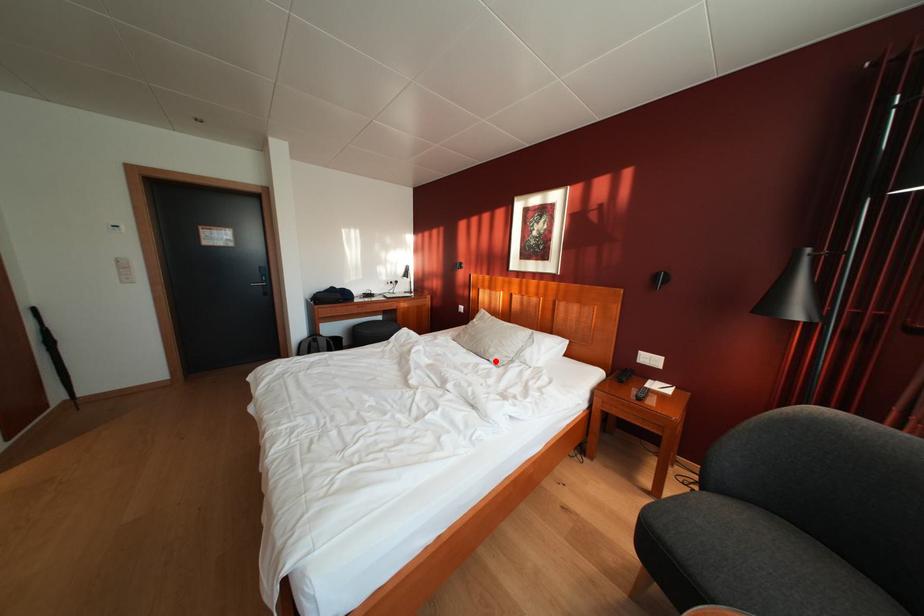
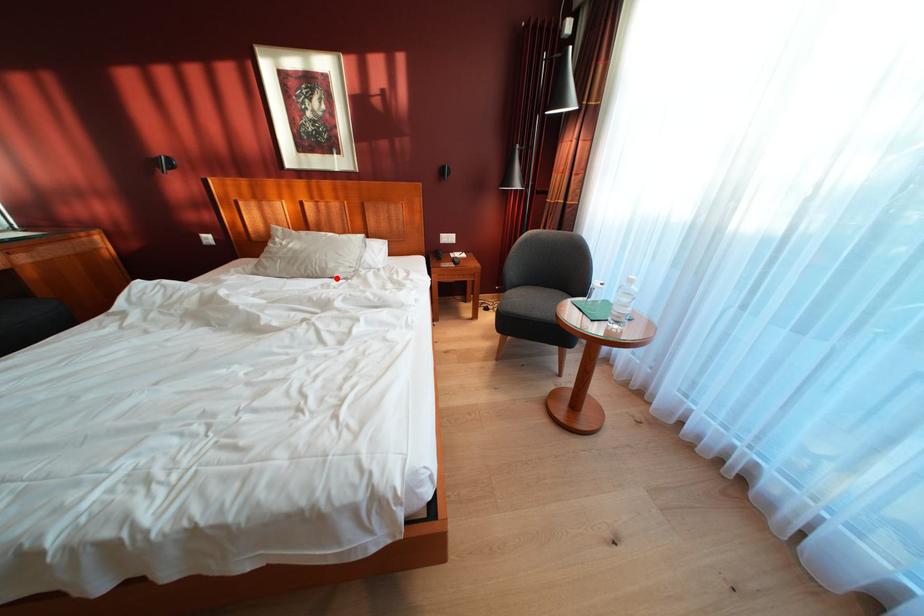
I am providing you with two images of the same scene from different viewpoints. A red point is marked on the first image and another point is marked on the second image. Do the highlighted points in image1 and image2 indicate the same real-world spot?

Yes